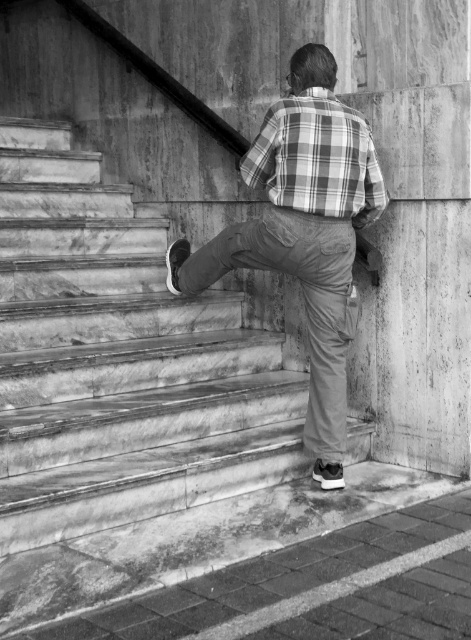
Question: Does plaid cotton shirt at center have a smaller size compared to plaid fabric shirt at center?

Choices:
 (A) yes
 (B) no

Answer: (B)

Question: Can you confirm if plaid cotton shirt at center is positioned above plaid fabric shirt at center?

Choices:
 (A) no
 (B) yes

Answer: (A)

Question: Is plaid cotton shirt at center above plaid fabric shirt at center?

Choices:
 (A) no
 (B) yes

Answer: (A)

Question: Among these objects, which one is farthest from the camera?

Choices:
 (A) plaid cotton shirt at center
 (B) plaid fabric shirt at center

Answer: (A)